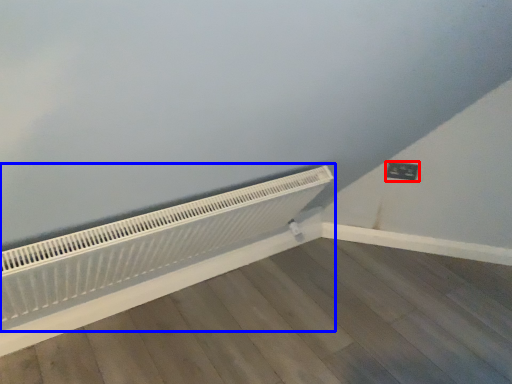
Question: Which object is further to the camera taking this photo, electric outlet (highlighted by a red box) or heater (highlighted by a blue box)?

Choices:
 (A) electric outlet
 (B) heater

Answer: (A)